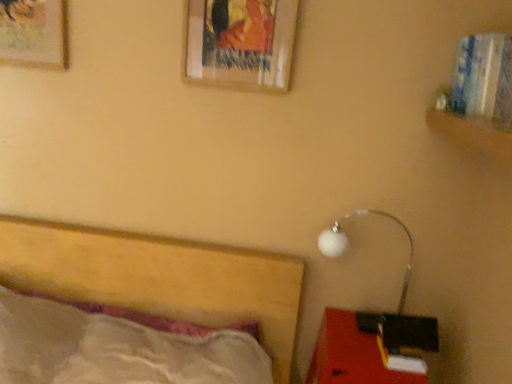
This screenshot has width=512, height=384. I want to click on vacant region above matte red desk at lower right (from a real-world perspective), so click(354, 339).